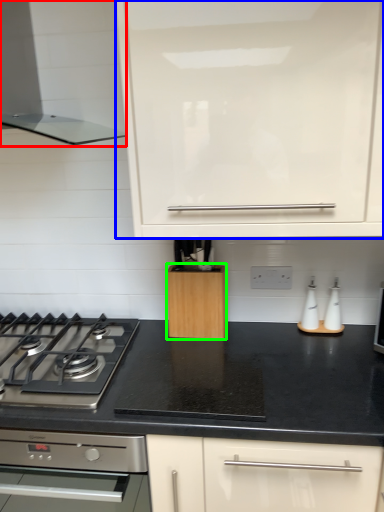
Question: Which object is the farthest from home appliance (highlighted by a red box)? Choose among these: cabinetry (highlighted by a blue box) or kitchen appliance (highlighted by a green box).

Choices:
 (A) cabinetry
 (B) kitchen appliance

Answer: (B)